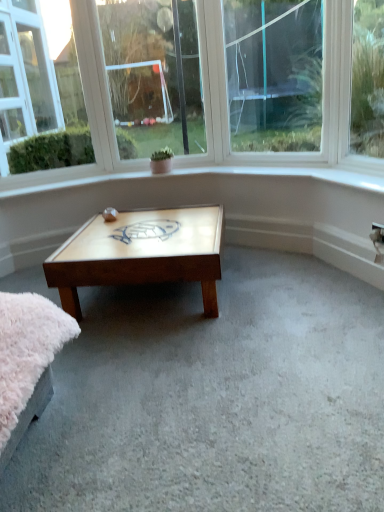
Locate an element on the screen. This screenshot has height=512, width=384. free space in front of wooden turtle at center is located at coordinates click(105, 229).